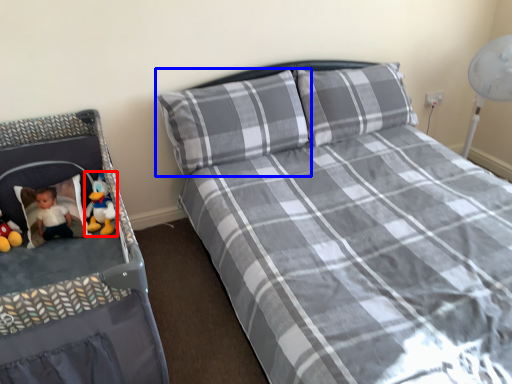
Question: Which object appears farthest to the camera in this image, toy (highlighted by a red box) or pillow (highlighted by a blue box)?

Choices:
 (A) toy
 (B) pillow

Answer: (A)